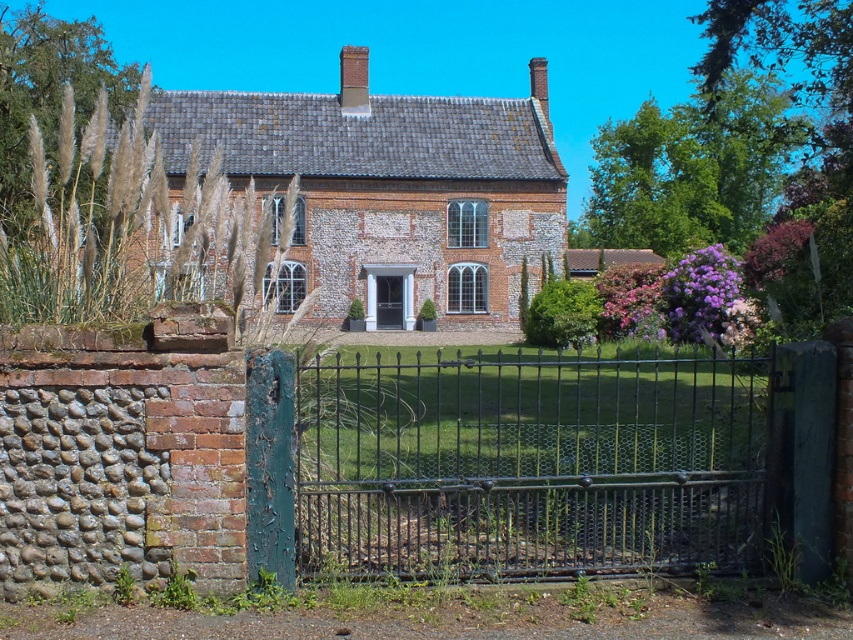
Question: Where is black wrought iron gate at center located in relation to black glass door at center in the image?

Choices:
 (A) below
 (B) above

Answer: (A)

Question: Which object appears farthest from the camera in this image?

Choices:
 (A) black wrought iron gate at center
 (B) black glass door at center

Answer: (B)

Question: Which object appears farthest from the camera in this image?

Choices:
 (A) black wrought iron gate at center
 (B) black glass door at center

Answer: (B)

Question: Which point is closer to the camera taking this photo?

Choices:
 (A) (490, 468)
 (B) (399, 291)

Answer: (A)

Question: Can you confirm if black wrought iron gate at center is wider than black glass door at center?

Choices:
 (A) no
 (B) yes

Answer: (B)

Question: Can you confirm if black wrought iron gate at center is positioned above black glass door at center?

Choices:
 (A) yes
 (B) no

Answer: (B)